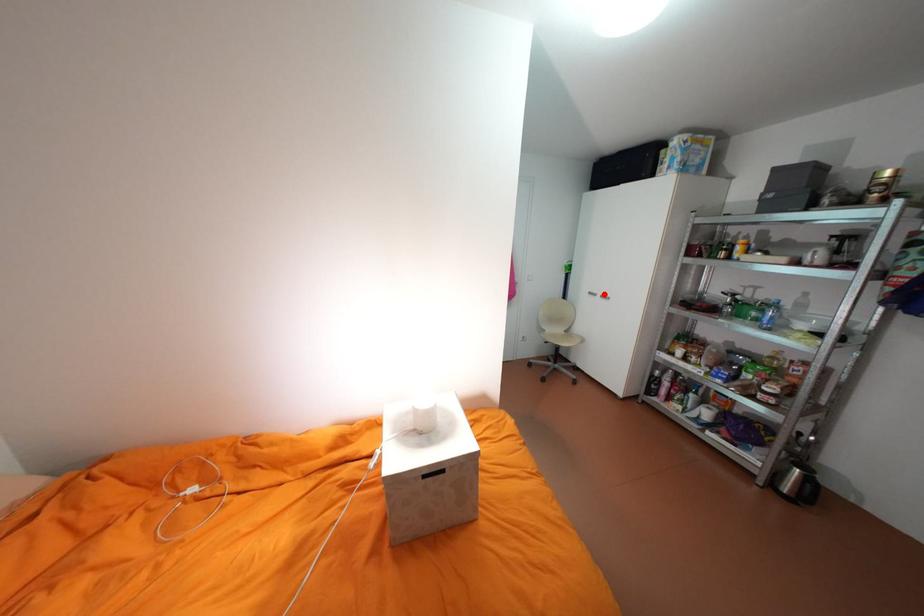
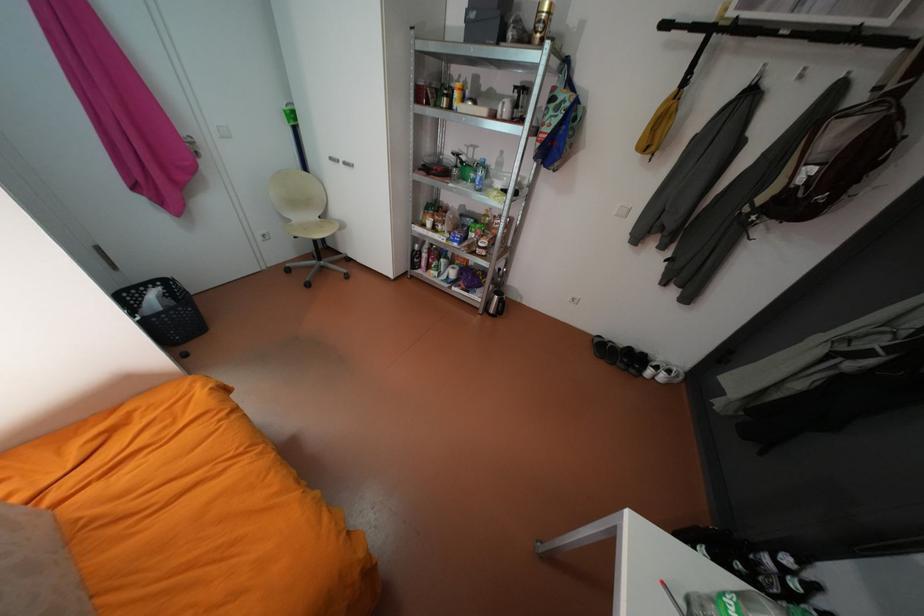
Question: I am providing you with two images of the same scene from different viewpoints. Image1 has a red point marked. In image2, the corresponding 3D location appears at what relative position? Reply with the corresponding letter.

Choices:
 (A) Closer
 (B) Farther

Answer: (B)